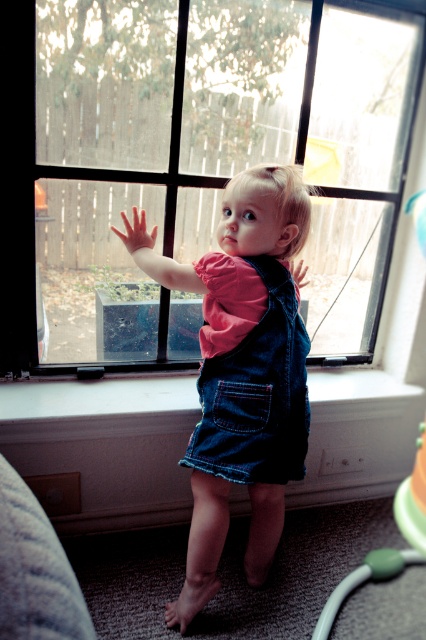
You are a parent trying to place a small plant pot that is 10 inches wide. You have two options in the room where the child is standing near the window. The options are the white painted wood at lower center and the green rubber toy at lower right. Which surface can fit the plant pot?

The white painted wood at lower center might be wider than green rubber toy at lower right, so it is more likely to fit the 10 inch wide plant pot.

You are a child trying to reach the green rubber toy at lower right and the pink flesh hand at upper center. Which object is wider?

The green rubber toy at lower right might be wider than the pink flesh hand at upper center.

You are a parent trying to clean up the room. You see the white painted wood at lower center and the green rubber toy at lower right. Which object is taller?

The green rubber toy at lower right is taller than the white painted wood at lower center.